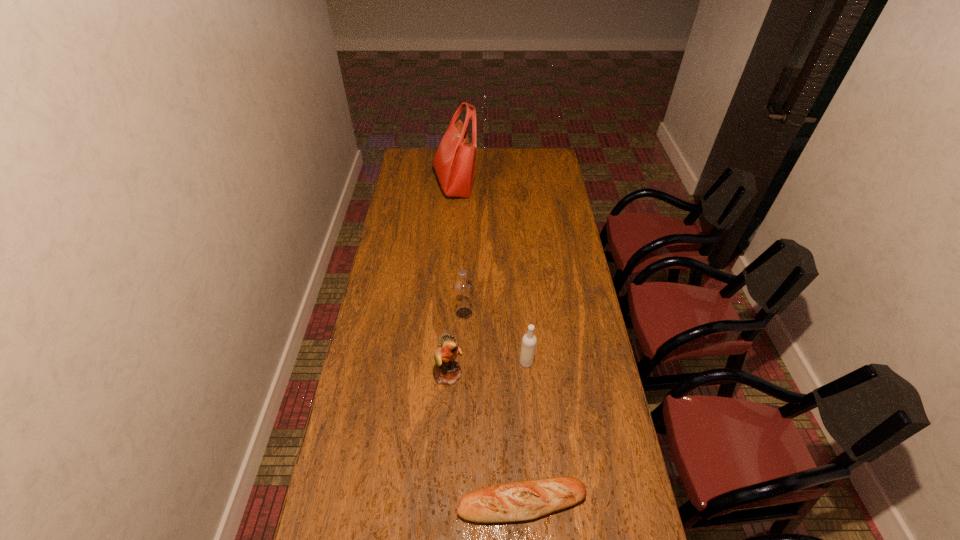
The width and height of the screenshot is (960, 540). Find the location of `vacant space located 0.080m on the front label of the second farthest object`. vacant space located 0.080m on the front label of the second farthest object is located at coordinates (493, 313).

I want to click on vacant space located 0.300m on the back of the right vodka, so (x=520, y=296).

Locate an element on the screen. vacant space located on the left of the baguet is located at coordinates (430, 502).

This screenshot has height=540, width=960. What are the coordinates of `object located in the far edge section of the desktop` in the screenshot? It's located at (455, 160).

Where is `object positioned at the right edge`? The height and width of the screenshot is (540, 960). object positioned at the right edge is located at coordinates (523, 500).

In order to click on free space at the far edge in this screenshot , I will do `click(482, 159)`.

Where is `vacant space at the left edge`? The width and height of the screenshot is (960, 540). vacant space at the left edge is located at coordinates (396, 353).

The width and height of the screenshot is (960, 540). In order to click on vacant region at the right edge in this screenshot , I will do `click(559, 297)`.

Locate an element on the screen. This screenshot has height=540, width=960. blank space at the far right corner is located at coordinates (555, 166).

Find the location of a particular element. vacant point located between the nearest object and the tallest object is located at coordinates (489, 343).